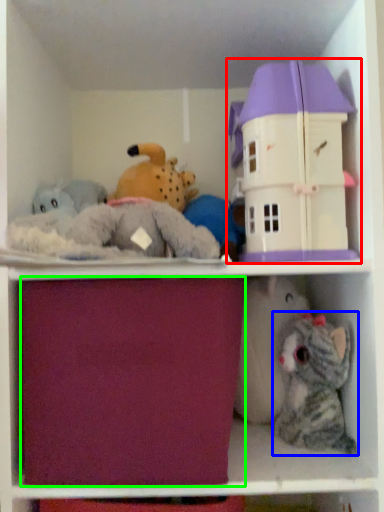
Question: Which object is the farthest from toy (highlighted by a red box)? Choose among these: toy (highlighted by a blue box) or drawer (highlighted by a green box).

Choices:
 (A) toy
 (B) drawer

Answer: (A)